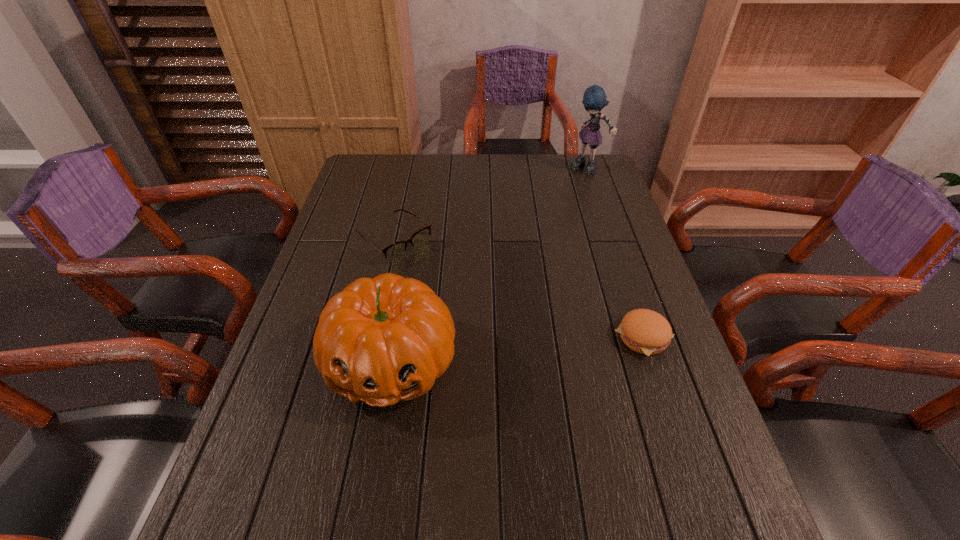
You are a GUI agent. You are given a task and a screenshot of the screen. Output one action in this format:
    pyautogui.click(x=<x>, y=<y>)
    Task: Click on the free space located 0.150m on the front-facing side of the tallest object
    The image size is (960, 540).
    Given the screenshot: What is the action you would take?
    (x=572, y=198)

The height and width of the screenshot is (540, 960). I want to click on free spot located 0.230m on the front-facing side of the tallest object, so click(x=566, y=211).

Identify the location of object positioned at the far edge. This screenshot has height=540, width=960. (594, 99).

Image resolution: width=960 pixels, height=540 pixels. Find the location of `pumpkin situated at the left edge`. pumpkin situated at the left edge is located at coordinates (384, 339).

Where is `spectacles positioned at the left edge`? The width and height of the screenshot is (960, 540). spectacles positioned at the left edge is located at coordinates (395, 251).

In order to click on patty at the right edge in this screenshot , I will do `click(647, 332)`.

The image size is (960, 540). I want to click on rag doll situated at the right edge, so click(x=594, y=99).

Find the location of a particular element. The height and width of the screenshot is (540, 960). object positioned at the far right corner is located at coordinates (594, 99).

I want to click on free location at the far edge, so click(560, 180).

The width and height of the screenshot is (960, 540). I want to click on vacant space at the near edge of the desktop, so click(x=419, y=460).